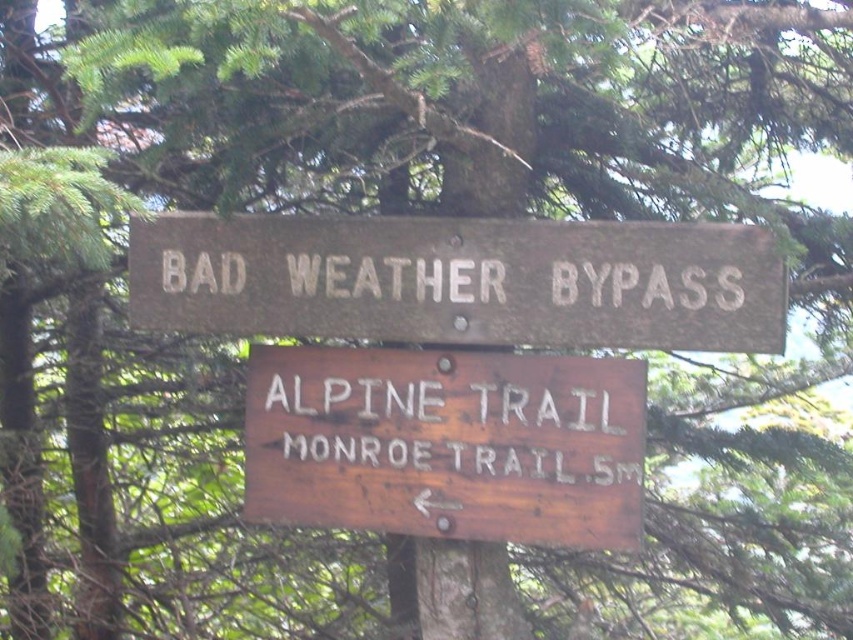
You are a hiker standing at the trailhead and see the weathered wood sign at upper center and the weathered wood sign at center. Which sign should you look at first to get directions for the Monroe Trail?

You should look at the weathered wood sign at center first because the weathered wood sign at upper center is closer to you, but the Monroe Trail directions are on the weathered wood sign at center which is further away. Wait, no, the description says the upper center is closer. Hmm, maybe I need to check the Objects Description again. The Objects Description says the upper center is closer, so the answer should be the center sign is further, so the Monroe Trail info is on the lower sign which is further?

You are standing in front of the two wooden signs at the trailhead. There are two points marked on the signs. Which point, point (718, 276) or point (276, 432), is closer to you?

Point (718, 276) is closer to the viewer than point (276, 432).